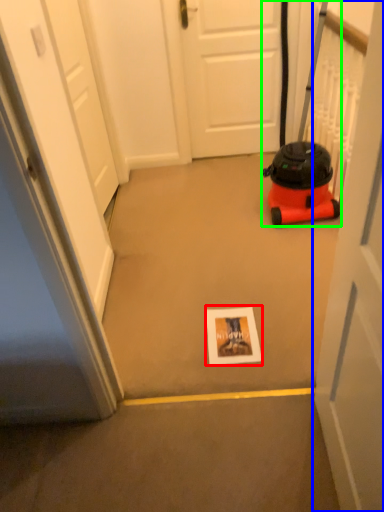
Question: Estimate the real-world distances between objects in this image. Which object is farther from postcard (highlighted by a red box), door (highlighted by a blue box) or equipment (highlighted by a green box)?

Choices:
 (A) door
 (B) equipment

Answer: (B)